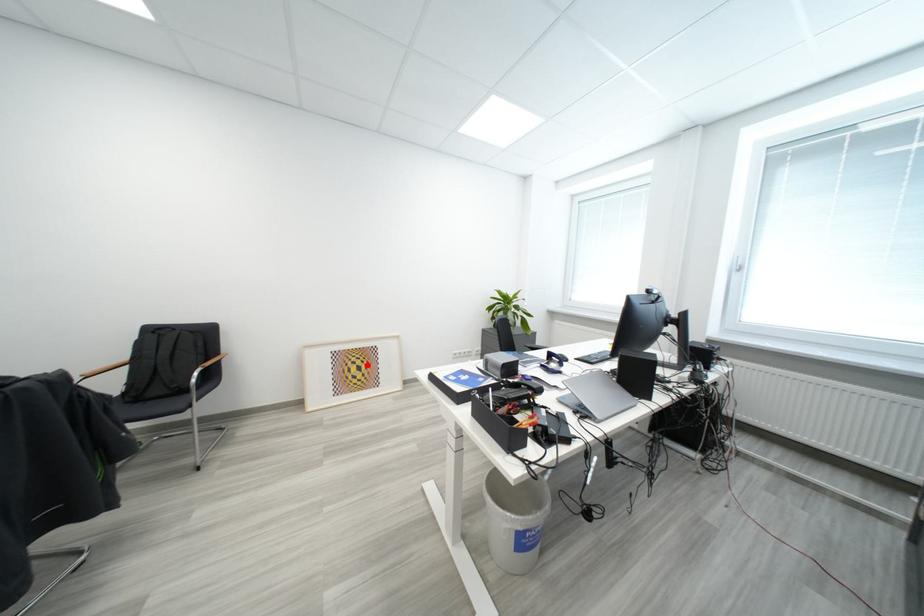
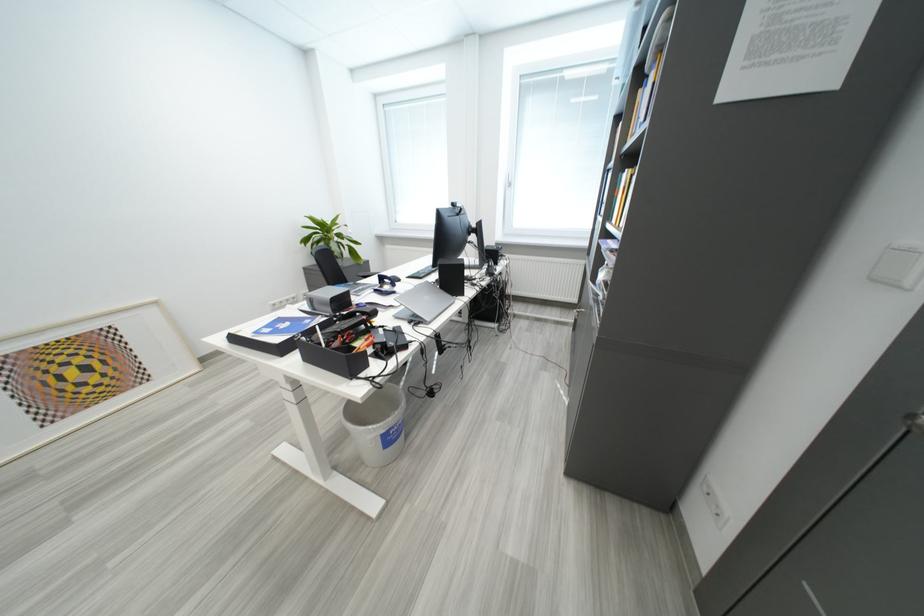
Locate, in the second image, the point that corresponds to the highlighted location in the first image.

(88, 363)